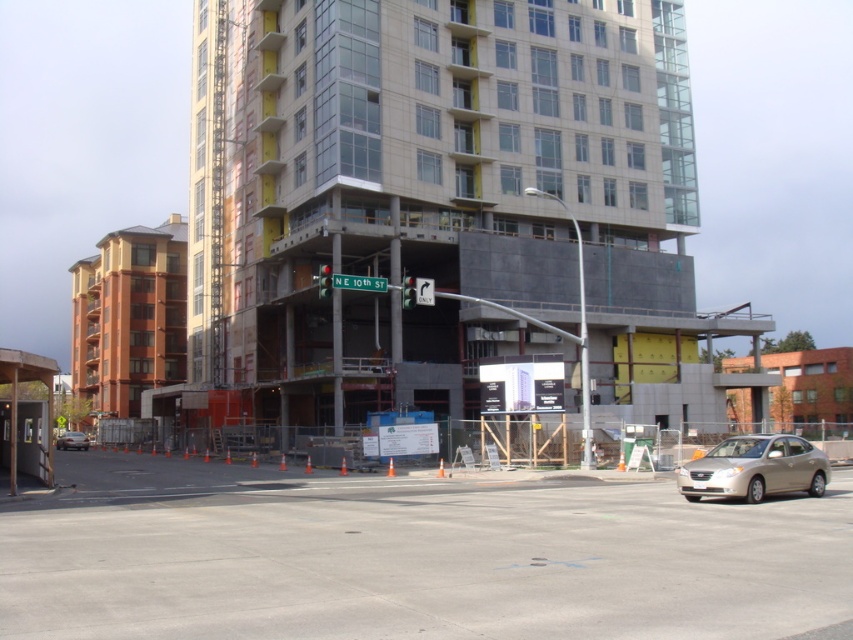
Question: Which point is farther to the camera?

Choices:
 (A) (320, 284)
 (B) (335, 275)
 (C) (415, 298)

Answer: (B)

Question: Among these objects, which one is farthest from the camera?

Choices:
 (A) red glass traffic light at center
 (B) green metallic street sign at upper center
 (C) matte silver sedan at lower left
 (D) green glass traffic light at center

Answer: (C)

Question: Does matte silver sedan at lower left have a lesser width compared to red glass traffic light at center?

Choices:
 (A) yes
 (B) no

Answer: (B)

Question: Does matte silver sedan at lower left appear on the left side of red glass traffic light at center?

Choices:
 (A) yes
 (B) no

Answer: (A)

Question: Can you confirm if green metallic street sign at upper center is positioned to the left of red glass traffic light at center?

Choices:
 (A) no
 (B) yes

Answer: (A)

Question: Which point appears closest to the camera in this image?

Choices:
 (A) (404, 285)
 (B) (386, 284)

Answer: (A)